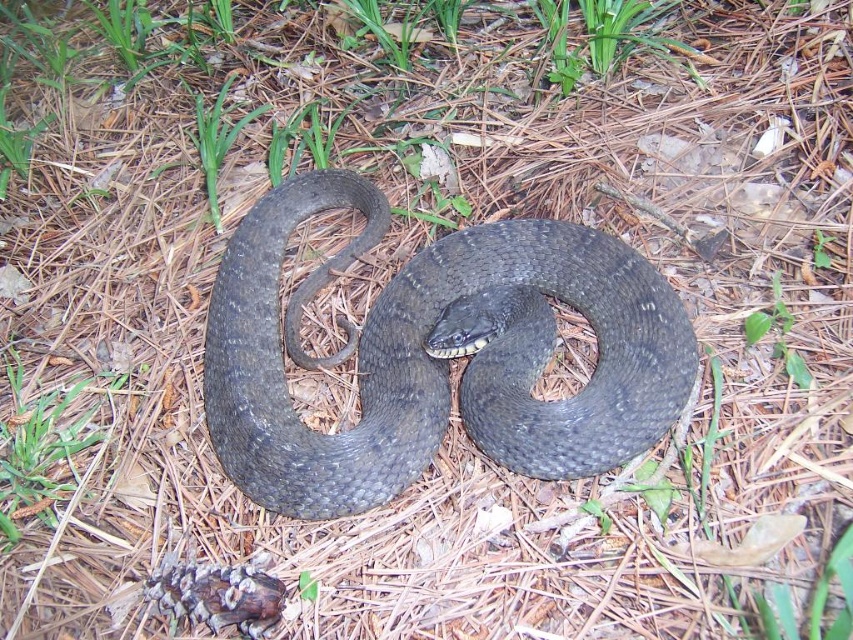
You are a hiker who just spotted the shiny dark gray snake at center and the green matte grass at lower left. Which object is closer to the left edge of the image?

The green matte grass at lower left is closer to the left edge of the image because the shiny dark gray snake at center is to the right of it.

You are a hiker who has spotted the shiny dark gray snake at center and the green matte grass at lower left. Based on their height, which one do you think is closer to your eye level?

The shiny dark gray snake at center is taller than green matte grass at lower left, so the snake is closer to your eye level since it appears taller.